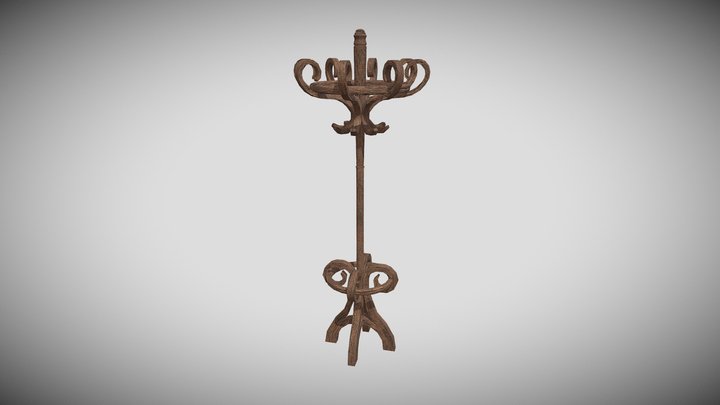
Locate an element on the screen. top section of coat rack is located at coordinates (360, 93).